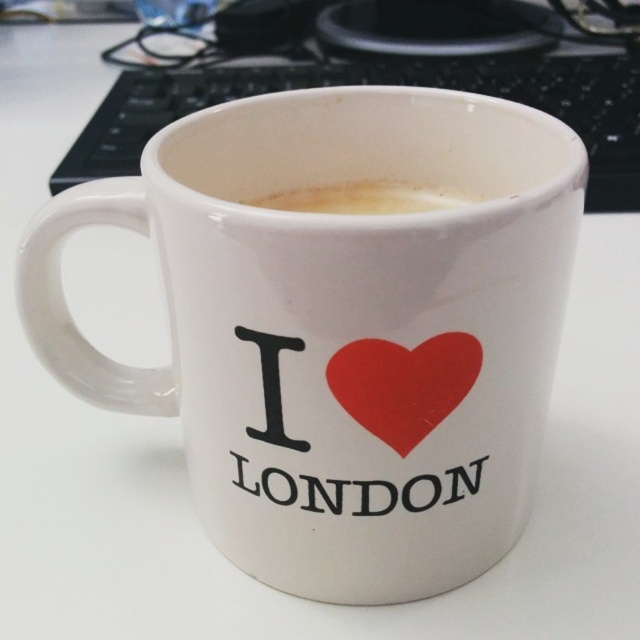
Who is positioned more to the left, white ceramic mug at center or red matte heart at center?

Positioned to the left is white ceramic mug at center.

Can you confirm if white ceramic mug at center is positioned to the right of red matte heart at center?

No, white ceramic mug at center is not to the right of red matte heart at center.

Who is more distant from viewer, (483, 312) or (397, 426)?

Positioned behind is point (397, 426).

Where is `white ceramic mug at center`? white ceramic mug at center is located at coordinates (340, 328).

Between white ceramic mug at center and white frothy coffee at center, which one appears on the left side from the viewer's perspective?

From the viewer's perspective, white ceramic mug at center appears more on the left side.

Can you confirm if white ceramic mug at center is positioned to the left of white frothy coffee at center?

Yes, white ceramic mug at center is to the left of white frothy coffee at center.

Who is more distant from viewer, (545, 161) or (312, 209)?

The point (312, 209) is behind.

Locate an element on the screen. This screenshot has width=640, height=640. white ceramic mug at center is located at coordinates (340, 328).

Is white ceramic mug at center bigger than black plastic keyboard at upper center?

Actually, white ceramic mug at center might be smaller than black plastic keyboard at upper center.

Who is higher up, white ceramic mug at center or black plastic keyboard at upper center?

black plastic keyboard at upper center is above.

Between point (248, 259) and point (157, 108), which one is positioned behind?

Positioned behind is point (157, 108).

Find the location of a particular element. Image resolution: width=640 pixels, height=640 pixels. white ceramic mug at center is located at coordinates (340, 328).